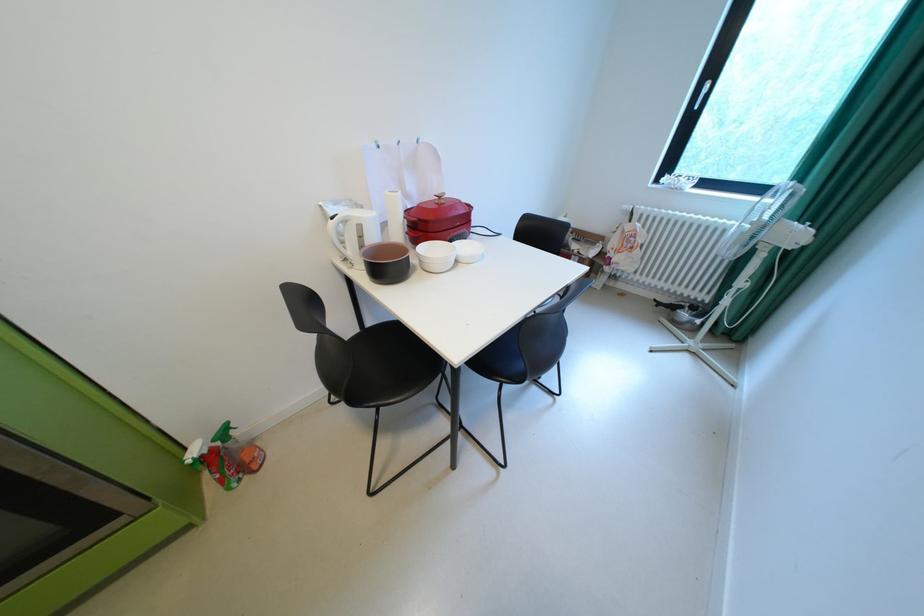
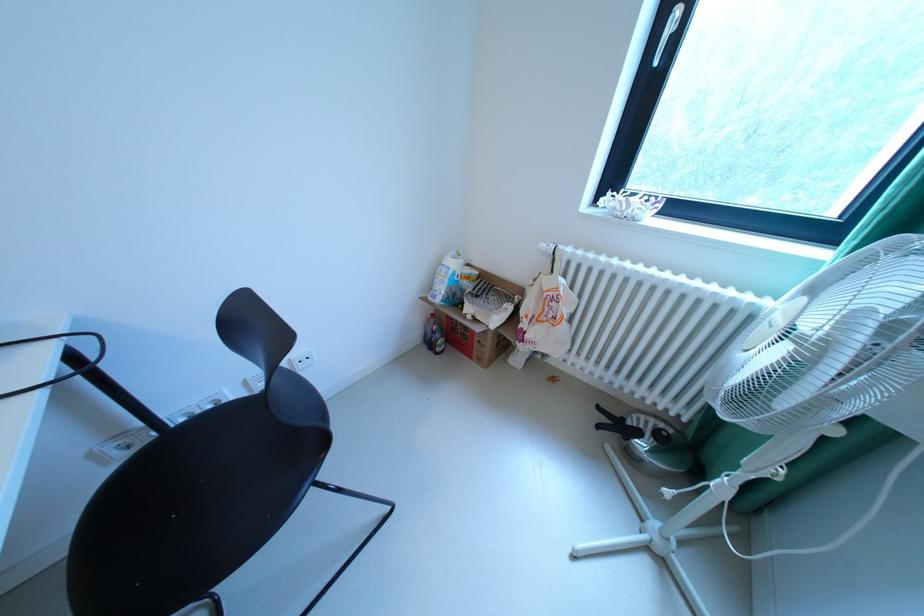
In the second image, find the point that corresponds to pixel 636 208 in the first image.

(553, 246)